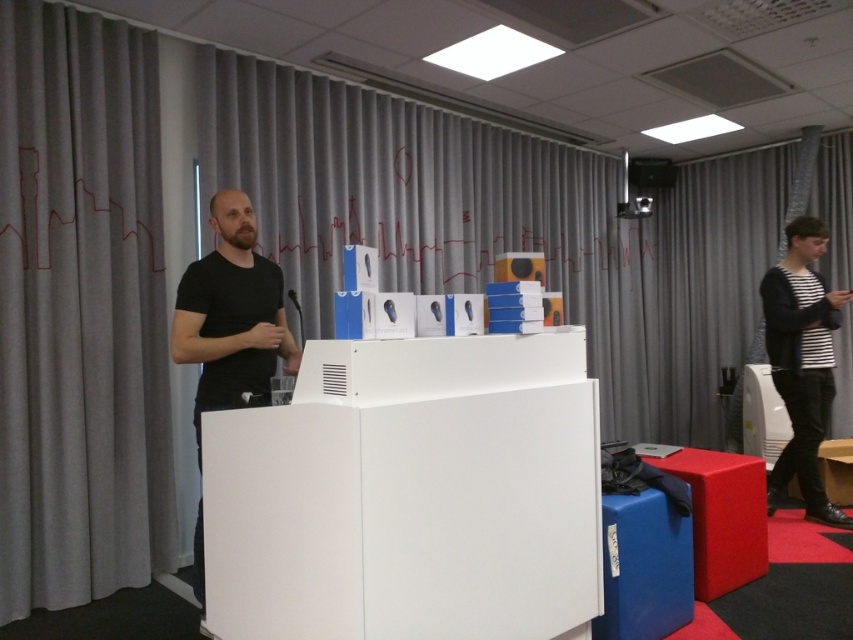
Question: Is rubberized red stool at lower right in front of matte black speaker at upper center?

Choices:
 (A) no
 (B) yes

Answer: (B)

Question: Which of the following is the closest to the observer?

Choices:
 (A) (813, 230)
 (B) (637, 196)
 (C) (691, 465)
 (D) (627, 164)

Answer: (C)

Question: Which of the following is the farthest from the observer?

Choices:
 (A) (223, 248)
 (B) (775, 371)
 (C) (653, 184)

Answer: (C)

Question: Which point appears closest to the camera in this image?

Choices:
 (A) (637, 212)
 (B) (816, 275)

Answer: (B)

Question: Does black matte shirt at center appear on the right side of rubberized red stool at lower right?

Choices:
 (A) yes
 (B) no

Answer: (B)

Question: Where is black matte shirt at center located in relation to striped cotton shirt at right in the image?

Choices:
 (A) left
 (B) right

Answer: (A)